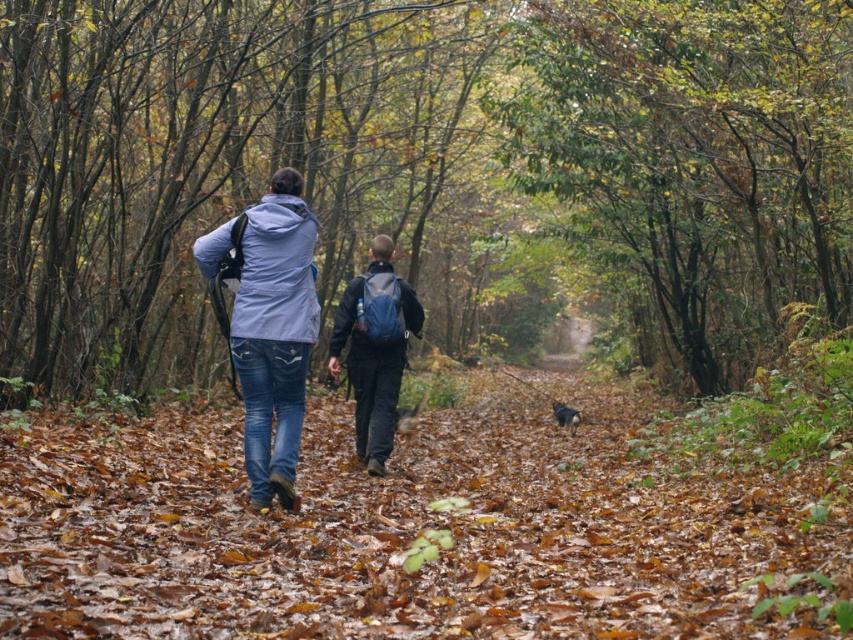
Question: Does matte blue jacket at center appear under shiny black fur at center?

Choices:
 (A) no
 (B) yes

Answer: (A)

Question: Does blue backpack at center appear on the right side of shiny black fur at center?

Choices:
 (A) yes
 (B) no

Answer: (B)

Question: Does brown leafy forest path at center have a smaller size compared to matte blue jacket at center?

Choices:
 (A) no
 (B) yes

Answer: (A)

Question: Among these points, which one is farthest from the camera?

Choices:
 (A) (576, 422)
 (B) (587, 532)

Answer: (A)

Question: Which object is farther from the camera taking this photo?

Choices:
 (A) shiny black fur at center
 (B) matte blue jacket at center

Answer: (A)

Question: Which point is farther from the camera taking this photo?

Choices:
 (A) (398, 364)
 (B) (566, 422)
 (C) (711, 584)

Answer: (B)